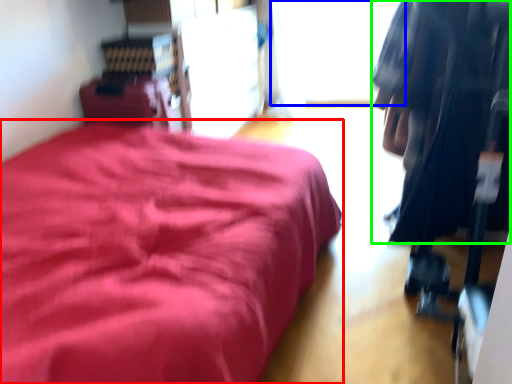
Question: Which object is positioned farthest from furniture (highlighted by a red box)? Select from window (highlighted by a blue box) and clothing (highlighted by a green box).

Choices:
 (A) window
 (B) clothing

Answer: (A)